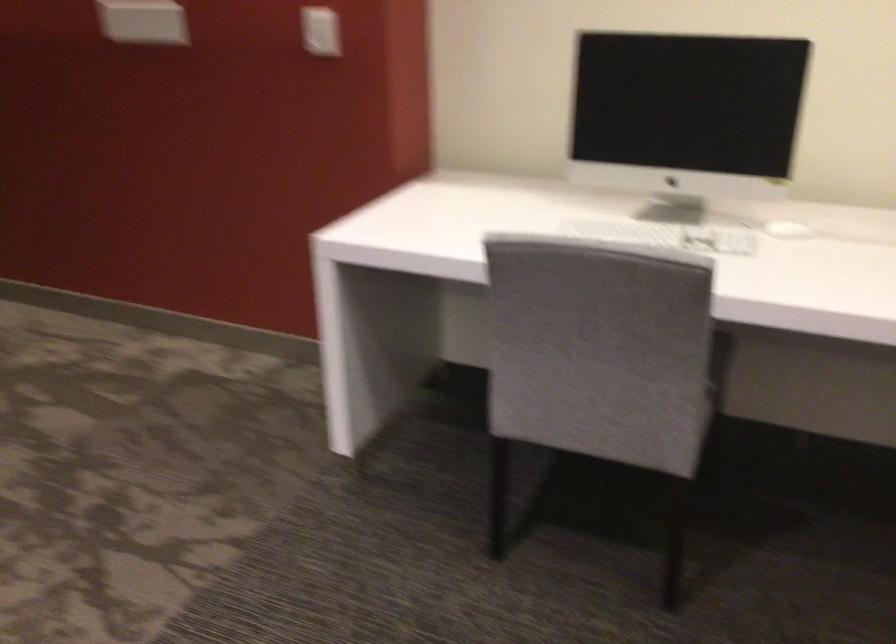
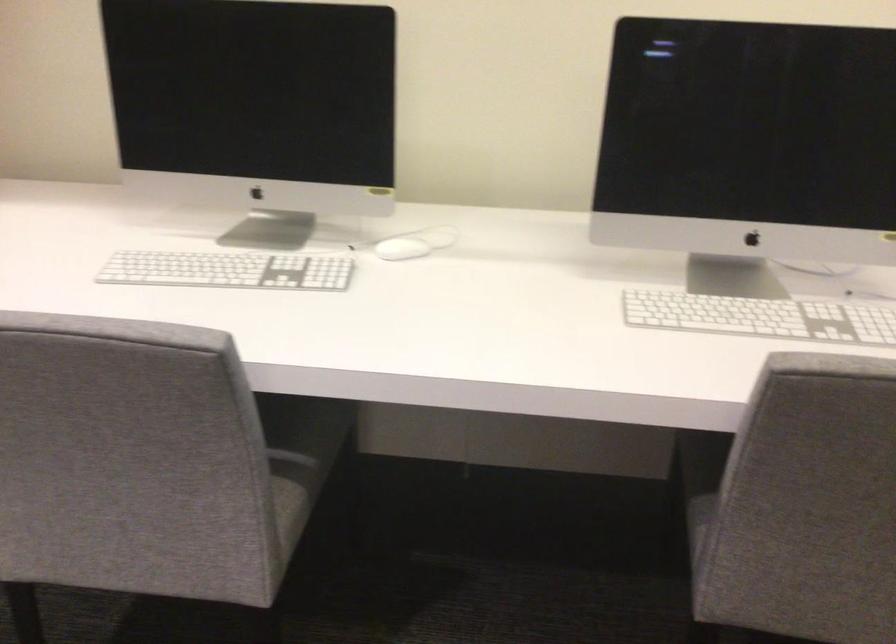
Question: The camera is either moving clockwise (left) or counter-clockwise (right) around the object. The first image is from the beginning of the video and the second image is from the end. Is the camera moving left or right when shooting the video?

Choices:
 (A) Left
 (B) Right

Answer: (A)